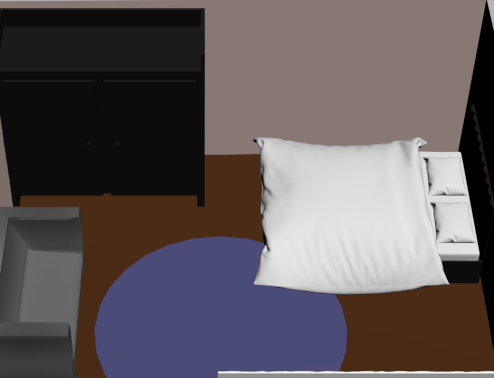
Locate an element on the screen. The height and width of the screenshot is (378, 494). gray sofa is located at coordinates (52, 289).